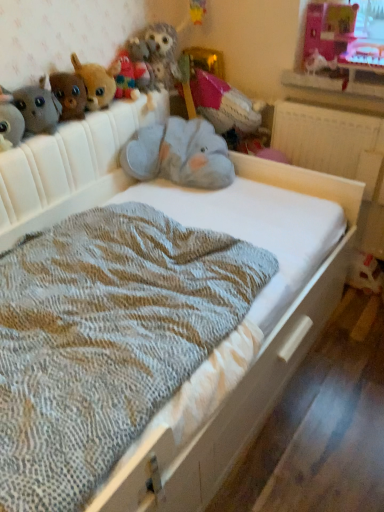
Question: Considering the positions of fuzzy fabric owl at upper center, the 1th animal from the left, and fuzzy gray plush at upper left, the first toy positioned from the left, in the image, is fuzzy fabric owl at upper center, the 1th animal from the left, wider or thinner than fuzzy gray plush at upper left, the first toy positioned from the left,?

Choices:
 (A) wide
 (B) thin

Answer: (A)

Question: From a real-world perspective, is fuzzy fabric owl at upper center, the 1th animal from the left, positioned above or below fuzzy gray plush at upper left, which is the sixth toy from right to left?

Choices:
 (A) above
 (B) below

Answer: (A)

Question: Based on their relative distances, which object is farther from the pink fabric stuffed animal at upper center, marked as the 1th toy in a right-to-left arrangement?

Choices:
 (A) fuzzy gray plush at upper left, which is the sixth toy from right to left
 (B) gray plush elephant at center, which is the fifth toy in left-to-right order
 (C) brown plush toy at upper left, the 4th toy when ordered from left to right
 (D) pink fabric window screen at upper right
 (E) white glossy bird at upper right, which is counted as the 2th animal, starting from the left

Answer: (A)

Question: Based on their relative distances, which object is nearer to the fuzzy fabric owl at upper center, which is the second animal in right-to-left order?

Choices:
 (A) brown plush toy at upper left, the third toy when ordered from left to right
 (B) white glossy bird at upper right, which is counted as the 2th animal, starting from the left
 (C) pink fabric window screen at upper right
 (D) fuzzy gray plush at upper left, which is the sixth toy from right to left
 (E) fuzzy fabric stuffed animal at upper left, which is the fifth toy from right to left

Answer: (A)